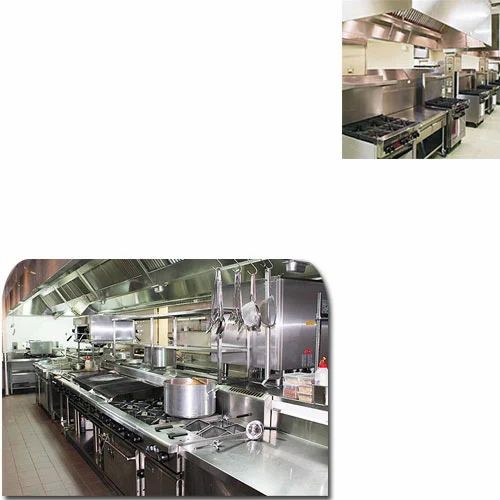
The image size is (500, 500). I want to click on ovens, so click(x=479, y=98), click(x=457, y=124), click(x=392, y=152), click(x=125, y=452).